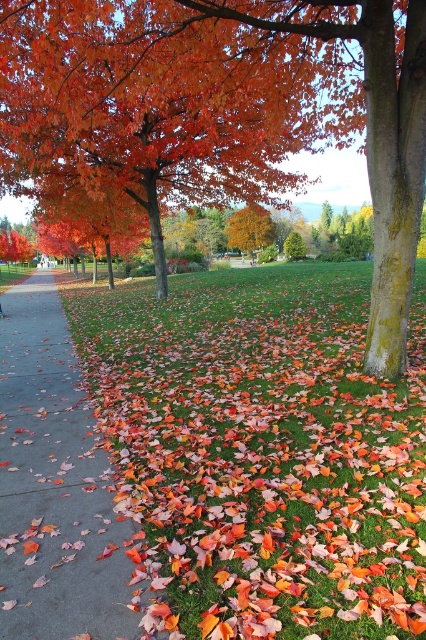
Question: Which of the following is the closest to the observer?

Choices:
 (A) gray concrete sidewalk at lower left
 (B) orange glossy tree at center

Answer: (A)

Question: Does gray concrete sidewalk at lower left lie in front of orange glossy tree at center?

Choices:
 (A) no
 (B) yes

Answer: (B)

Question: Can you confirm if gray concrete sidewalk at lower left is thinner than orange glossy tree at center?

Choices:
 (A) yes
 (B) no

Answer: (B)

Question: Is gray concrete sidewalk at lower left in front of orange glossy tree at center?

Choices:
 (A) no
 (B) yes

Answer: (B)

Question: Which point appears closest to the camera in this image?

Choices:
 (A) (267, 237)
 (B) (8, 387)

Answer: (B)

Question: Which of the following is the closest to the observer?

Choices:
 (A) (63, 632)
 (B) (258, 243)

Answer: (A)